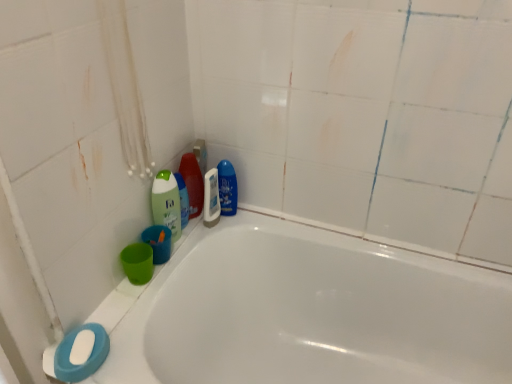
This screenshot has height=384, width=512. What are the coordinates of `vacant space that's between white glossy mouthwash at center and white matte soap at lower left` in the screenshot? It's located at [159, 281].